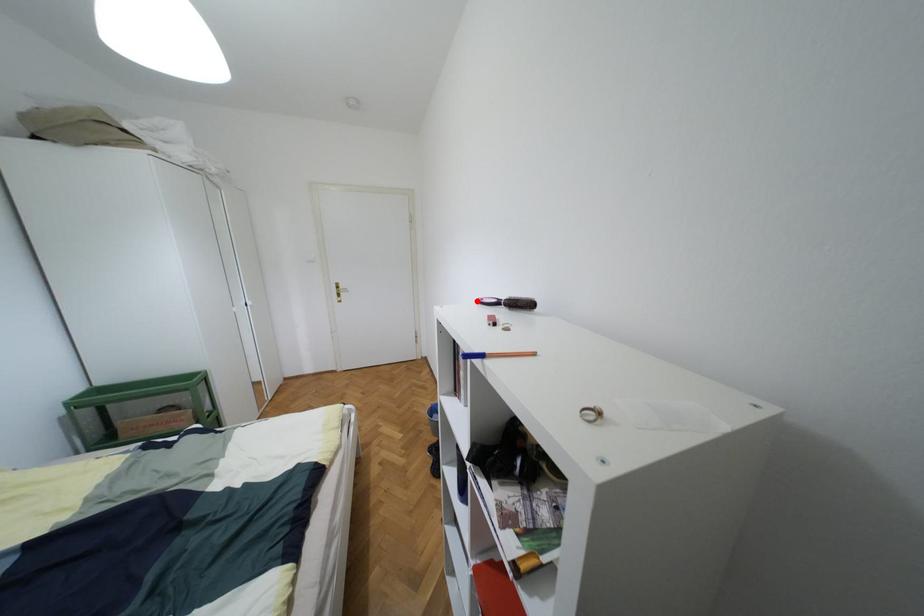
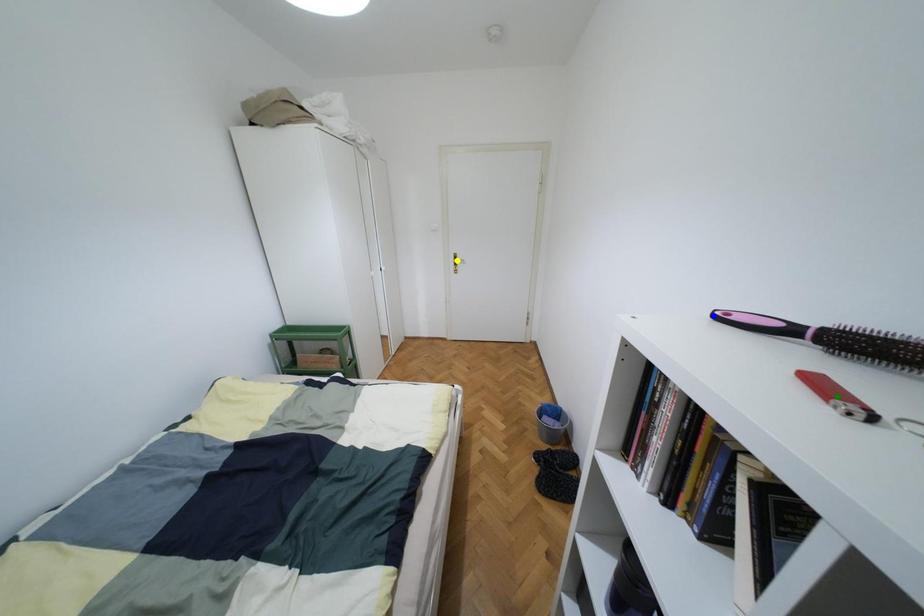
Question: I am providing you with two images of the same scene from different viewpoints. A red point is marked on the first image. You are given multiple points on the second image. Which point in image 2 is actually the same real-world point as the red point in image 1?

Choices:
 (A) blue point
 (B) yellow point
 (C) green point

Answer: (A)